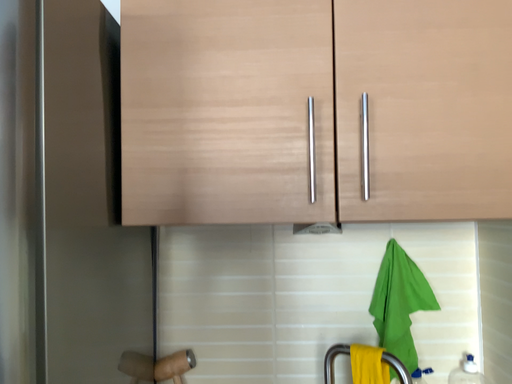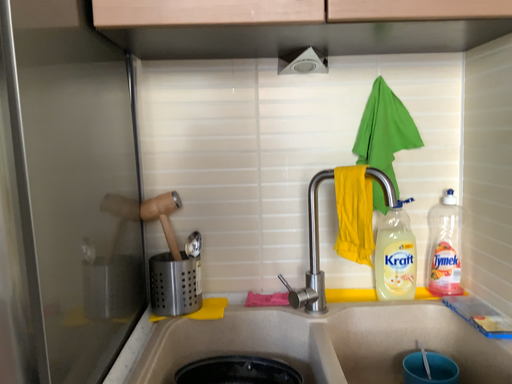
Question: Which way did the camera rotate in the video?

Choices:
 (A) rotated downward
 (B) rotated upward

Answer: (A)